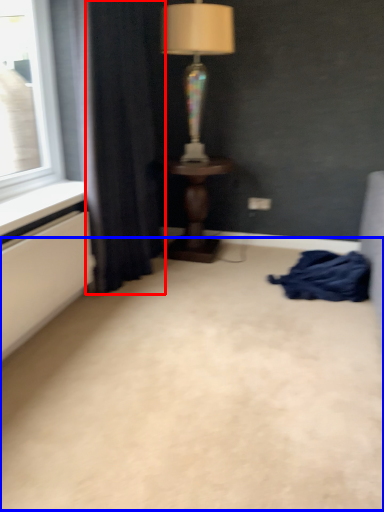
Question: Which of the following is the farthest to the observer, curtain (highlighted by a red box) or plain (highlighted by a blue box)?

Choices:
 (A) curtain
 (B) plain

Answer: (A)